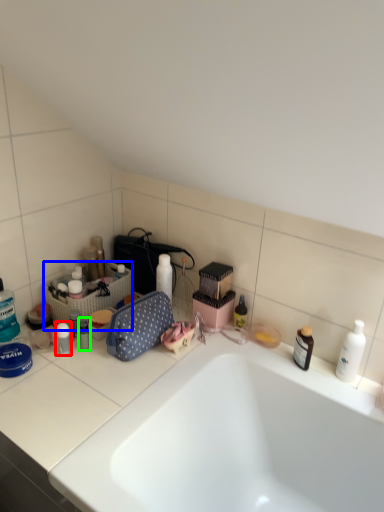
Question: Considering the real-world distances, which object is farthest from toiletry (highlighted by a red box)? laundry basket (highlighted by a blue box) or toiletry (highlighted by a green box)?

Choices:
 (A) laundry basket
 (B) toiletry

Answer: (A)